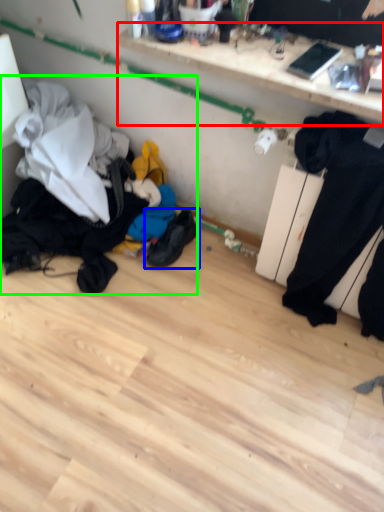
Question: Based on their relative distances, which object is farther from shelf (highlighted by a red box)? Choose from footwear (highlighted by a blue box) and laundry (highlighted by a green box).

Choices:
 (A) footwear
 (B) laundry

Answer: (A)